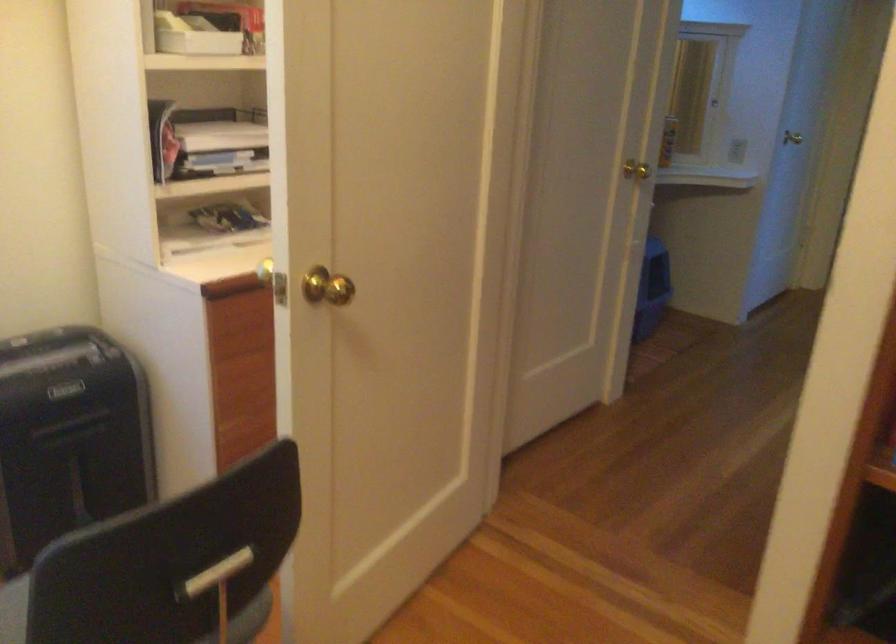
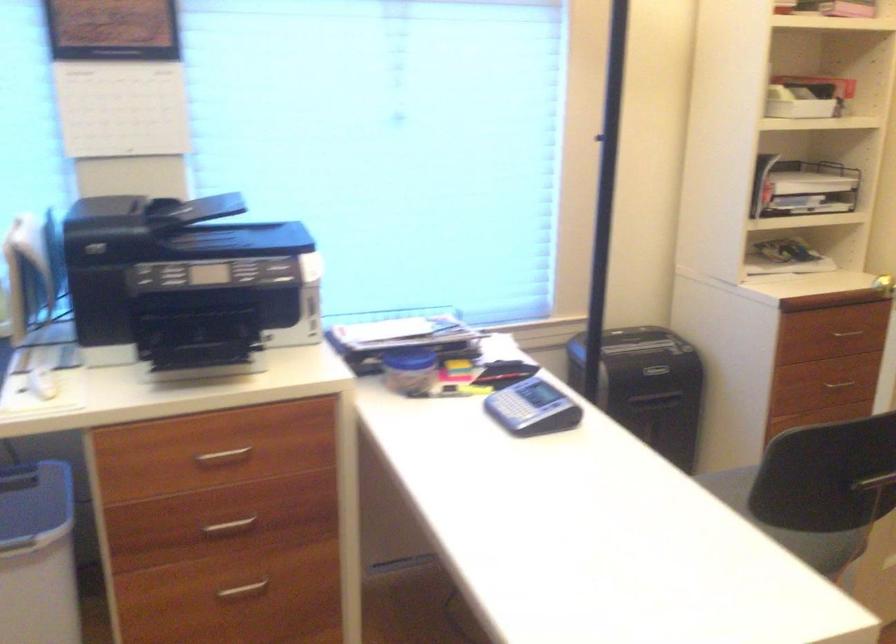
Question: The camera is either moving clockwise (left) or counter-clockwise (right) around the object. The first image is from the beginning of the video and the second image is from the end. Is the camera moving left or right when shooting the video?

Choices:
 (A) Left
 (B) Right

Answer: (B)